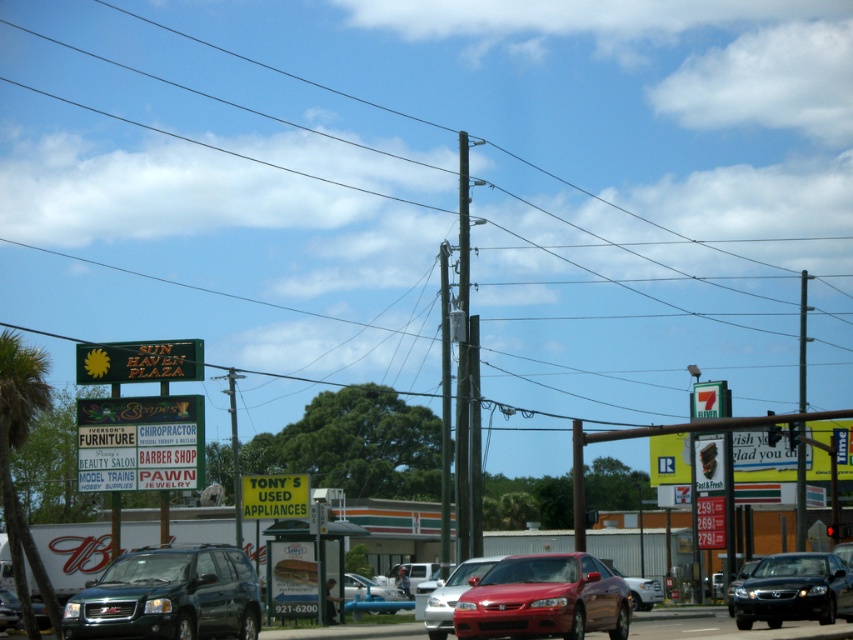
Can you confirm if green plastic signboard at center is positioned to the left of green plastic sign at upper left?

Incorrect, green plastic signboard at center is not on the left side of green plastic sign at upper left.

Is green plastic signboard at center above green plastic sign at upper left?

No, green plastic signboard at center is not above green plastic sign at upper left.

Who is more forward, (140,404) or (99,362)?

Point (140,404) is more forward.

Where is `green plastic signboard at center`? green plastic signboard at center is located at coordinates (140, 442).

Who is more distant from viewer, (x=260, y=228) or (x=256, y=593)?

The point (x=260, y=228) is more distant.

Measure the distance between point (843,74) and camera.

A distance of 625.60 feet exists between point (843,74) and camera.

Is point (521, 150) positioned behind point (131, 563)?

Yes, point (521, 150) is behind point (131, 563).

The width and height of the screenshot is (853, 640). What are the coordinates of `green wooden pole at center` in the screenshot? It's located at (442, 189).

Can you confirm if green plastic sign at upper left is bigger than metallic blue car at center?

Actually, green plastic sign at upper left might be smaller than metallic blue car at center.

Is green plastic sign at upper left thinner than metallic blue car at center?

Incorrect, green plastic sign at upper left's width is not less than metallic blue car at center's.

The height and width of the screenshot is (640, 853). I want to click on green plastic sign at upper left, so click(138, 362).